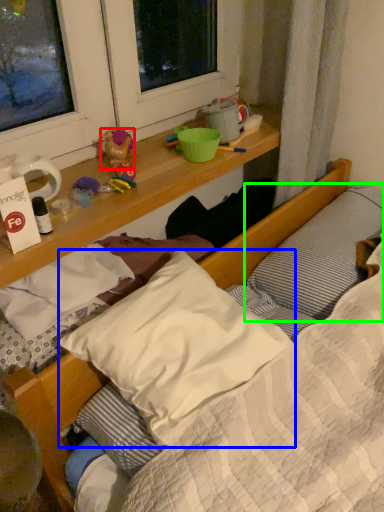
Question: Which object is the farthest from toy (highlighted by a red box)? Choose among these: pillow (highlighted by a blue box) or pillow (highlighted by a green box).

Choices:
 (A) pillow
 (B) pillow

Answer: (B)